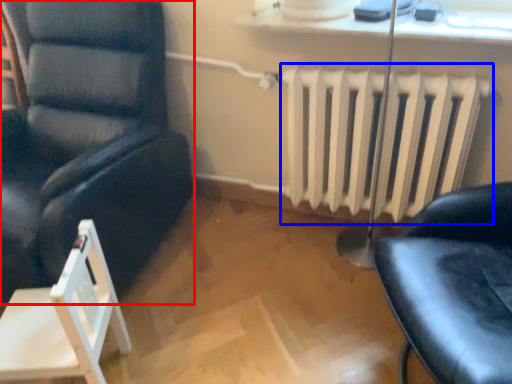
Question: Which of the following is the closest to the observer, chair (highlighted by a red box) or radiator (highlighted by a blue box)?

Choices:
 (A) chair
 (B) radiator

Answer: (A)